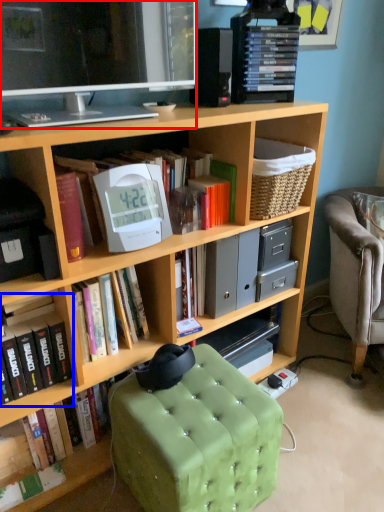
Question: Among these objects, which one is nearest to the camera, television (highlighted by a red box) or book (highlighted by a blue box)?

Choices:
 (A) television
 (B) book

Answer: (A)